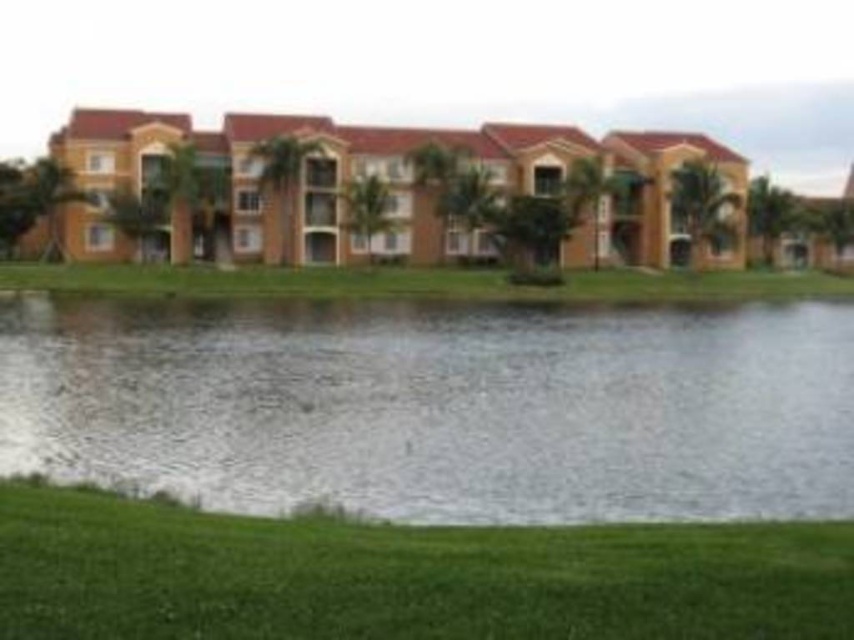
Question: Is clear water at lower center wider than green grass at lower center?

Choices:
 (A) yes
 (B) no

Answer: (A)

Question: Can you confirm if clear water at lower center is smaller than green grass at lower center?

Choices:
 (A) no
 (B) yes

Answer: (A)

Question: Can you confirm if clear water at lower center is thinner than green grass at lower center?

Choices:
 (A) yes
 (B) no

Answer: (B)

Question: Which point is farther to the camera?

Choices:
 (A) (648, 579)
 (B) (787, 360)

Answer: (B)

Question: Which of the following is the closest to the observer?

Choices:
 (A) coord(144,388)
 (B) coord(829,525)

Answer: (B)